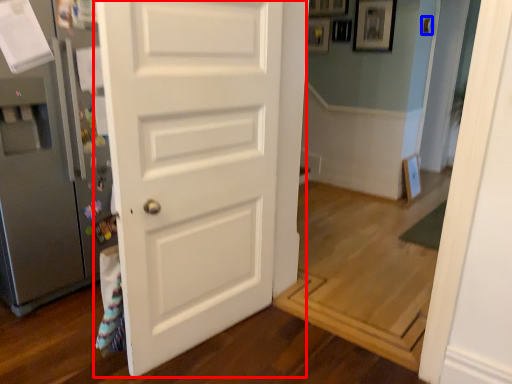
Question: Which point is closer to the camera, door (highlighted by a red box) or door handle (highlighted by a blue box)?

Choices:
 (A) door
 (B) door handle

Answer: (A)